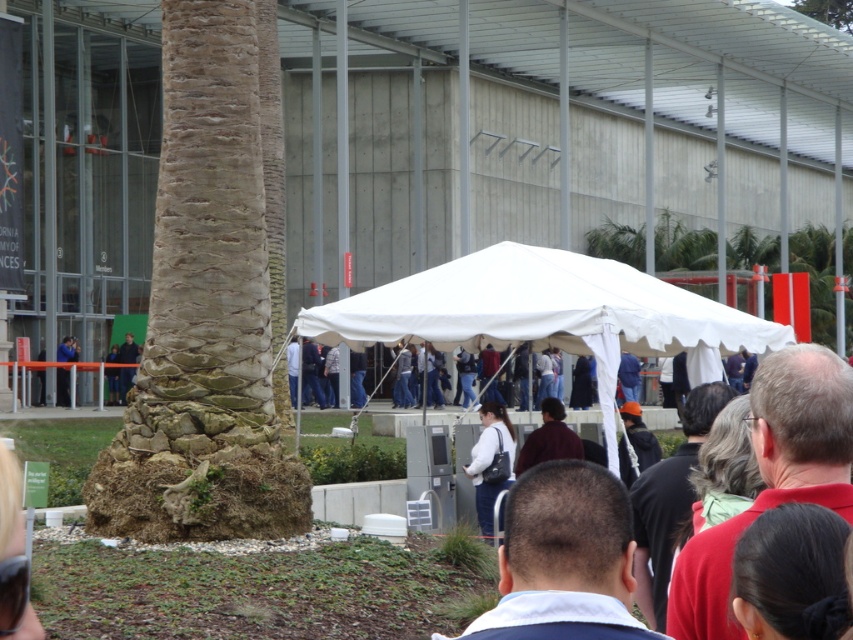
You are standing at the point labeled point (x=128, y=348) and want to see the point labeled point (x=677, y=337). Is there any obstruction between you and the point?

Point (x=677, y=337) is in front of point (x=128, y=348), so there is no obstruction between you and the point.

You are standing at the point with coordinates point (491, 461). What object is located at this point?

The point (491, 461) indicates the location of the white matte jacket at center.

You are standing at the point labeled point (71, 353) and want to walk towards the point labeled point (496, 406). Which direction should you move relative to your current position?

Since point (496, 406) is closer to the viewer than point (71, 353), you should move forward towards the point labeled point (496, 406).